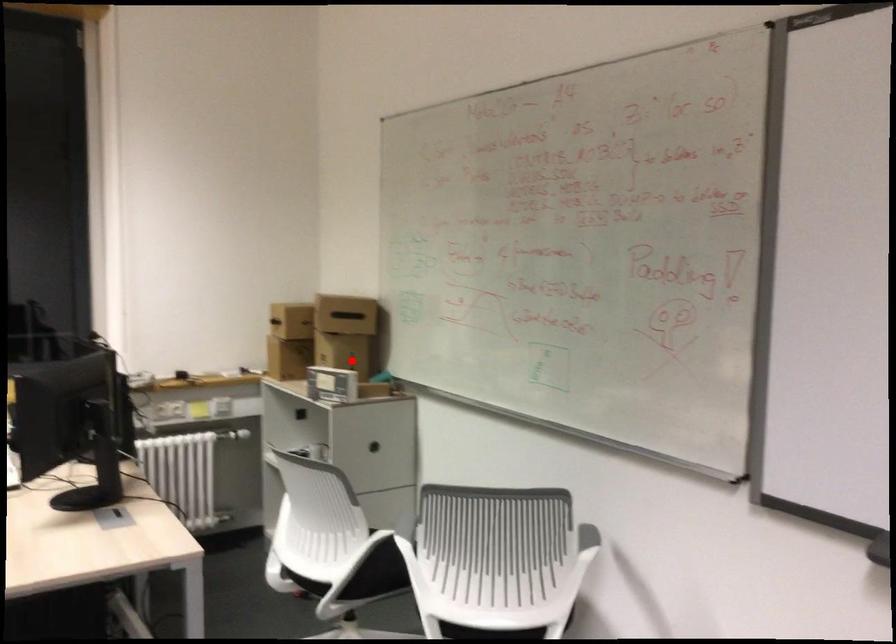
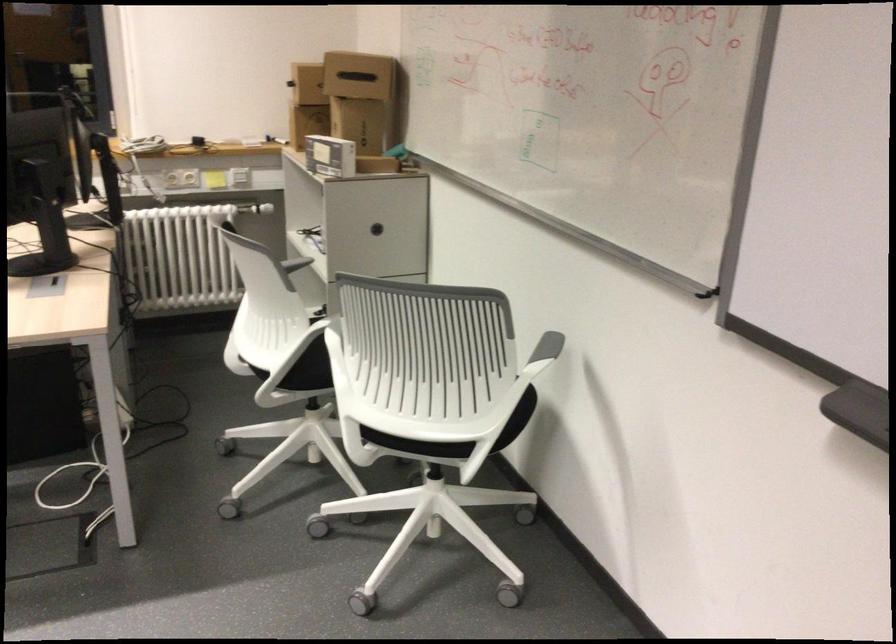
Where in the second image is the point corresponding to the highlighted location from the first image?

(366, 131)